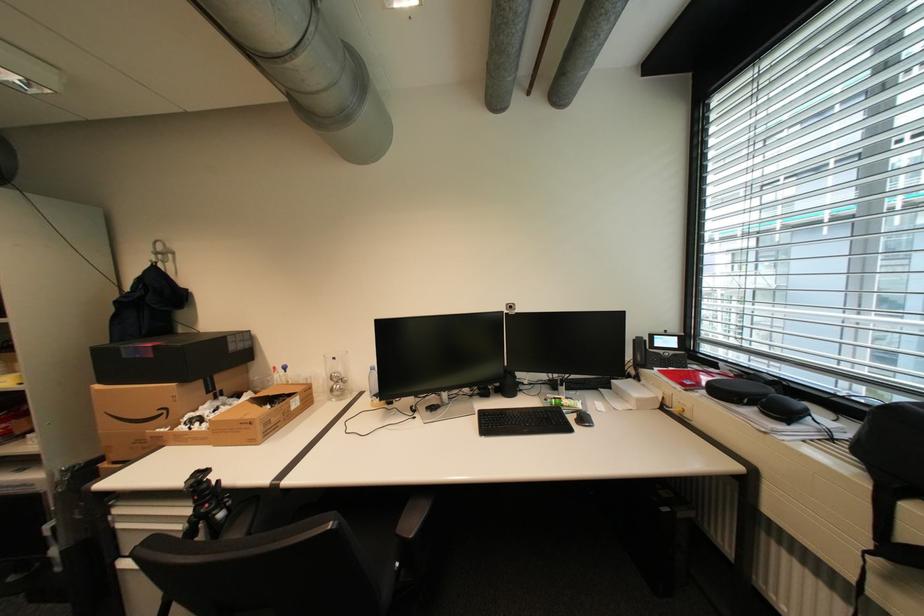
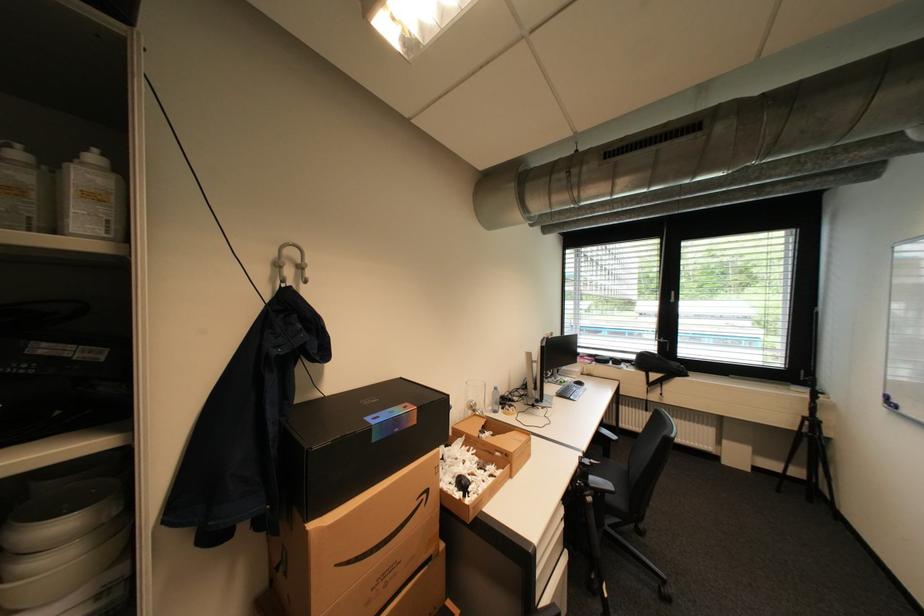
Where in the second image is the point corresponding to [293,395] from the first image?

(492, 426)